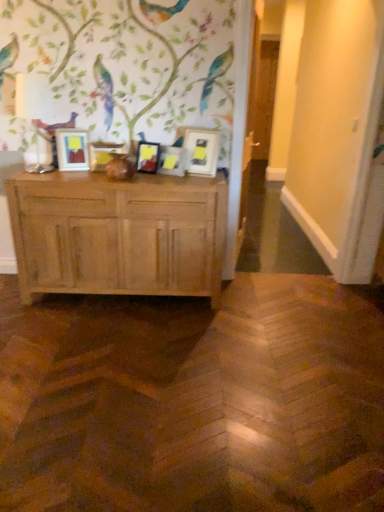
Question: From the image's perspective, is matte wooden picture frame at left, arranged as the first picture frame when viewed from the left, on top of matte white picture frame at center, marked as the fourth picture frame in a left-to-right arrangement?

Choices:
 (A) no
 (B) yes

Answer: (B)

Question: Considering the relative positions of matte wooden picture frame at left, the fifth picture frame from the right, and matte white picture frame at center, marked as the fourth picture frame in a left-to-right arrangement, in the image provided, is matte wooden picture frame at left, the fifth picture frame from the right, to the right of matte white picture frame at center, marked as the fourth picture frame in a left-to-right arrangement, from the viewer's perspective?

Choices:
 (A) yes
 (B) no

Answer: (B)

Question: From the image's perspective, is matte wooden picture frame at left, arranged as the first picture frame when viewed from the left, under matte white picture frame at center, marked as the fourth picture frame in a left-to-right arrangement?

Choices:
 (A) yes
 (B) no

Answer: (B)

Question: Considering the relative sizes of matte wooden picture frame at left, the fifth picture frame from the right, and matte white picture frame at center, marked as the fourth picture frame in a left-to-right arrangement, in the image provided, is matte wooden picture frame at left, the fifth picture frame from the right, smaller than matte white picture frame at center, marked as the fourth picture frame in a left-to-right arrangement,?

Choices:
 (A) no
 (B) yes

Answer: (A)

Question: Is matte wooden picture frame at left, arranged as the first picture frame when viewed from the left, next to matte white picture frame at center, marked as the fourth picture frame in a left-to-right arrangement?

Choices:
 (A) yes
 (B) no

Answer: (B)

Question: Is matte white picture frame at center, the second picture frame when ordered from right to left, surrounded by matte wooden picture frame at left, the fifth picture frame from the right?

Choices:
 (A) no
 (B) yes

Answer: (A)

Question: Considering the relative sizes of matte wooden picture frame at center, which is the 2th picture frame from left to right, and matte wooden picture frame at left, arranged as the first picture frame when viewed from the left, in the image provided, is matte wooden picture frame at center, which is the 2th picture frame from left to right, smaller than matte wooden picture frame at left, arranged as the first picture frame when viewed from the left,?

Choices:
 (A) no
 (B) yes

Answer: (B)

Question: Does matte wooden picture frame at center, which appears as the fourth picture frame when viewed from the right, have a greater height compared to matte wooden picture frame at left, arranged as the first picture frame when viewed from the left?

Choices:
 (A) yes
 (B) no

Answer: (B)

Question: Does matte wooden picture frame at center, which is the 2th picture frame from left to right, appear on the left side of matte wooden picture frame at left, arranged as the first picture frame when viewed from the left?

Choices:
 (A) no
 (B) yes

Answer: (A)

Question: Is matte wooden picture frame at center, which appears as the fourth picture frame when viewed from the right, thinner than matte wooden picture frame at left, the fifth picture frame from the right?

Choices:
 (A) yes
 (B) no

Answer: (A)

Question: Is matte wooden picture frame at center, which appears as the fourth picture frame when viewed from the right, behind matte wooden picture frame at left, arranged as the first picture frame when viewed from the left?

Choices:
 (A) yes
 (B) no

Answer: (A)

Question: Does matte wooden picture frame at center, which appears as the fourth picture frame when viewed from the right, come in front of matte wooden picture frame at left, arranged as the first picture frame when viewed from the left?

Choices:
 (A) yes
 (B) no

Answer: (B)

Question: Are matte white picture frame at center, the second picture frame when ordered from right to left, and matte wooden picture frame at left, the fifth picture frame from the right, making contact?

Choices:
 (A) no
 (B) yes

Answer: (A)